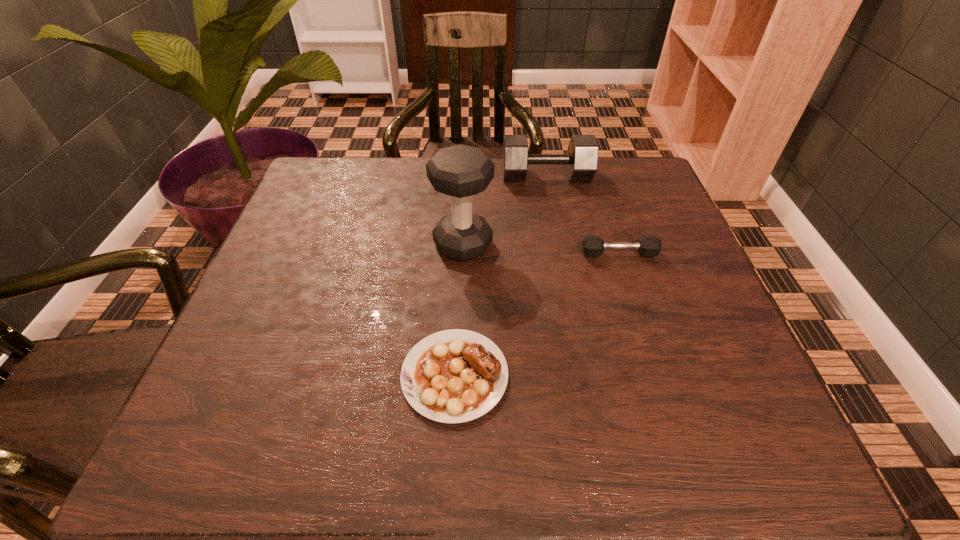
Identify the location of free region at the far right corner of the desktop. This screenshot has height=540, width=960. (645, 183).

Locate an element on the screen. Image resolution: width=960 pixels, height=540 pixels. free location at the near right corner of the desktop is located at coordinates (754, 428).

The height and width of the screenshot is (540, 960). Identify the location of vacant point located between the tallest dumbbell and the shortest dumbbell. (540, 249).

You are a GUI agent. You are given a task and a screenshot of the screen. Output one action in this format:
    pyautogui.click(x=<x>, y=<y>)
    Task: Click on the unoccupied position between the third shortest object and the steak
    This screenshot has height=540, width=960.
    Given the screenshot: What is the action you would take?
    pyautogui.click(x=500, y=275)

The width and height of the screenshot is (960, 540). What are the coordinates of `vacant area between the second tallest object and the shortest dumbbell` in the screenshot? It's located at (583, 215).

Find the location of `vacant space that is in between the farthest object and the leftmost dumbbell`. vacant space that is in between the farthest object and the leftmost dumbbell is located at coordinates (505, 210).

At what (x,y) coordinates should I click in order to perform the action: click on vacant region between the tallest object and the shortest dumbbell. Please return your answer as a coordinate pair (x, y). Looking at the image, I should click on pyautogui.click(x=540, y=249).

You are a GUI agent. You are given a task and a screenshot of the screen. Output one action in this format:
    pyautogui.click(x=<x>, y=<y>)
    Task: Click on the vacant region between the leftmost dumbbell and the shortest object
    This screenshot has width=960, height=540.
    Given the screenshot: What is the action you would take?
    pyautogui.click(x=459, y=310)

Locate an element on the screen. This screenshot has height=540, width=960. vacant point located between the shortest object and the leftmost dumbbell is located at coordinates (459, 310).

Locate an element on the screen. This screenshot has width=960, height=540. vacant area that lies between the second shortest object and the steak is located at coordinates (537, 314).